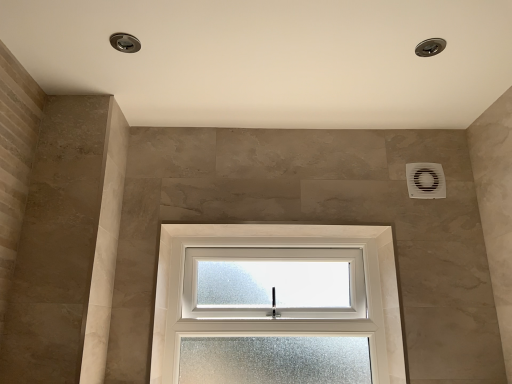
Question: Is white frosted glass window at center surrounding white plastic air conditioning unit at upper right?

Choices:
 (A) yes
 (B) no

Answer: (B)

Question: Does white frosted glass window at center have a lesser height compared to white plastic air conditioning unit at upper right?

Choices:
 (A) no
 (B) yes

Answer: (A)

Question: Does white frosted glass window at center appear on the left side of white plastic air conditioning unit at upper right?

Choices:
 (A) yes
 (B) no

Answer: (A)

Question: Does white frosted glass window at center appear on the right side of white plastic air conditioning unit at upper right?

Choices:
 (A) yes
 (B) no

Answer: (B)

Question: Would you say white frosted glass window at center is a long distance from white plastic air conditioning unit at upper right?

Choices:
 (A) yes
 (B) no

Answer: (B)

Question: Is white frosted glass window at center aimed at white plastic air conditioning unit at upper right?

Choices:
 (A) yes
 (B) no

Answer: (B)

Question: Is white plastic air conditioning unit at upper right to the right of white frosted glass window at center from the viewer's perspective?

Choices:
 (A) no
 (B) yes

Answer: (B)

Question: Is white plastic air conditioning unit at upper right wider than white frosted glass window at center?

Choices:
 (A) yes
 (B) no

Answer: (B)

Question: Is white plastic air conditioning unit at upper right facing away from white frosted glass window at center?

Choices:
 (A) yes
 (B) no

Answer: (B)

Question: Is the position of white plastic air conditioning unit at upper right more distant than that of white frosted glass window at center?

Choices:
 (A) yes
 (B) no

Answer: (A)

Question: Is white frosted glass window at center a part of white plastic air conditioning unit at upper right?

Choices:
 (A) no
 (B) yes

Answer: (A)

Question: Is the depth of white plastic air conditioning unit at upper right less than that of white frosted glass window at center?

Choices:
 (A) yes
 (B) no

Answer: (B)

Question: Looking at the image, does white frosted glass window at center seem bigger or smaller compared to white plastic air conditioning unit at upper right?

Choices:
 (A) small
 (B) big

Answer: (B)